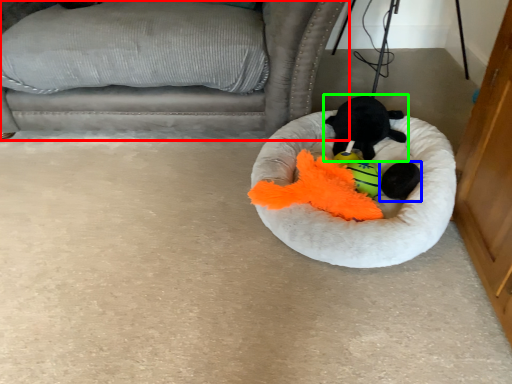
Question: Which object is positioned farthest from furniture (highlighted by a red box)? Select from animal (highlighted by a blue box) and toy (highlighted by a green box).

Choices:
 (A) animal
 (B) toy

Answer: (A)